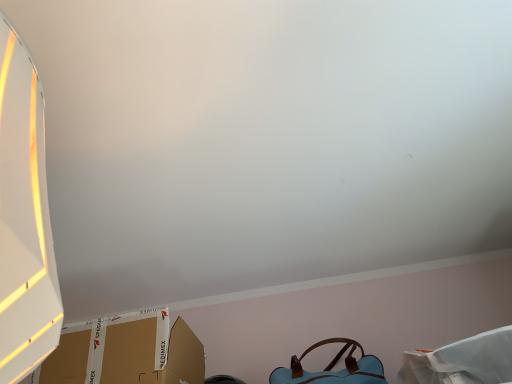
Question: Would you say brown cardboard box at lower left is inside or outside light blue leather handbag at lower right?

Choices:
 (A) inside
 (B) outside

Answer: (B)

Question: From their relative heights in the image, would you say brown cardboard box at lower left is taller or shorter than light blue leather handbag at lower right?

Choices:
 (A) short
 (B) tall

Answer: (B)

Question: Looking at the image, does brown cardboard box at lower left seem bigger or smaller compared to light blue leather handbag at lower right?

Choices:
 (A) small
 (B) big

Answer: (B)

Question: Does point (289, 370) appear closer or farther from the camera than point (80, 326)?

Choices:
 (A) farther
 (B) closer

Answer: (A)

Question: Considering the positions of light blue leather handbag at lower right and brown cardboard box at lower left in the image, is light blue leather handbag at lower right bigger or smaller than brown cardboard box at lower left?

Choices:
 (A) big
 (B) small

Answer: (B)

Question: Looking at their shapes, would you say light blue leather handbag at lower right is wider or thinner than brown cardboard box at lower left?

Choices:
 (A) wide
 (B) thin

Answer: (B)

Question: Relative to brown cardboard box at lower left, is light blue leather handbag at lower right in front or behind?

Choices:
 (A) front
 (B) behind

Answer: (B)